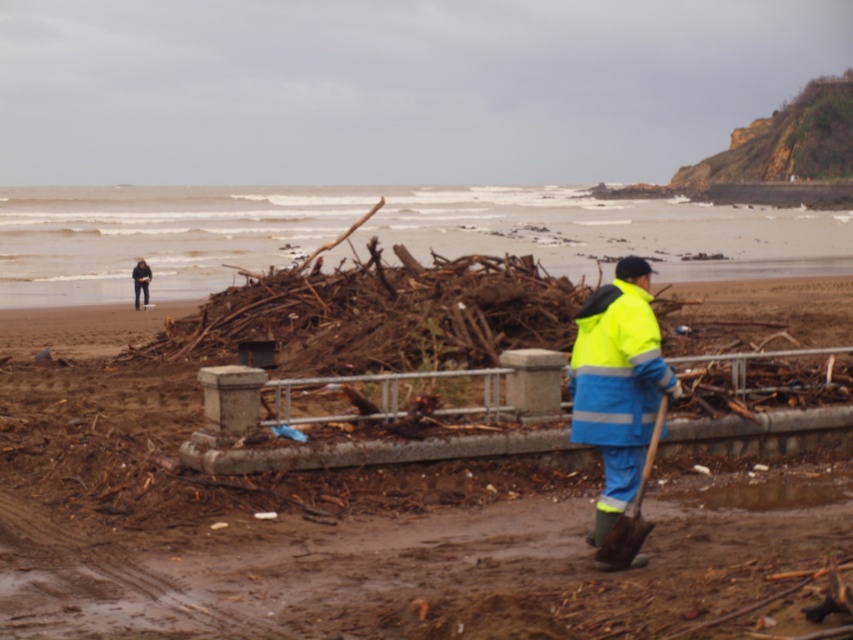
Question: Which point appears closest to the camera in this image?

Choices:
 (A) (9, 365)
 (B) (135, 294)
 (C) (619, 513)

Answer: (C)

Question: Does matte brown driftwood at center appear over wooden shovel at lower right?

Choices:
 (A) yes
 (B) no

Answer: (A)

Question: Estimate the real-world distances between objects in this image. Which object is closer to the neon yellow fabric shovel at center?

Choices:
 (A) wooden shovel at lower right
 (B) matte brown driftwood at center
 (C) dark clothing figure at far left

Answer: (A)

Question: Which of the following is the farthest from the observer?

Choices:
 (A) (572, 381)
 (B) (192, 524)
 (C) (136, 280)
 (D) (621, 532)

Answer: (C)

Question: Is matte brown driftwood at center to the right of wooden shovel at lower right from the viewer's perspective?

Choices:
 (A) yes
 (B) no

Answer: (B)

Question: Is wooden shovel at lower right positioned behind dark clothing figure at far left?

Choices:
 (A) yes
 (B) no

Answer: (B)